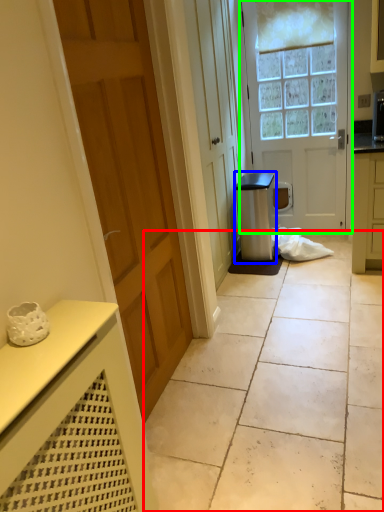
Question: Which object is positioned closest to concrete (highlighted by a red box)? Select from appliance (highlighted by a blue box) and door (highlighted by a green box).

Choices:
 (A) appliance
 (B) door

Answer: (A)